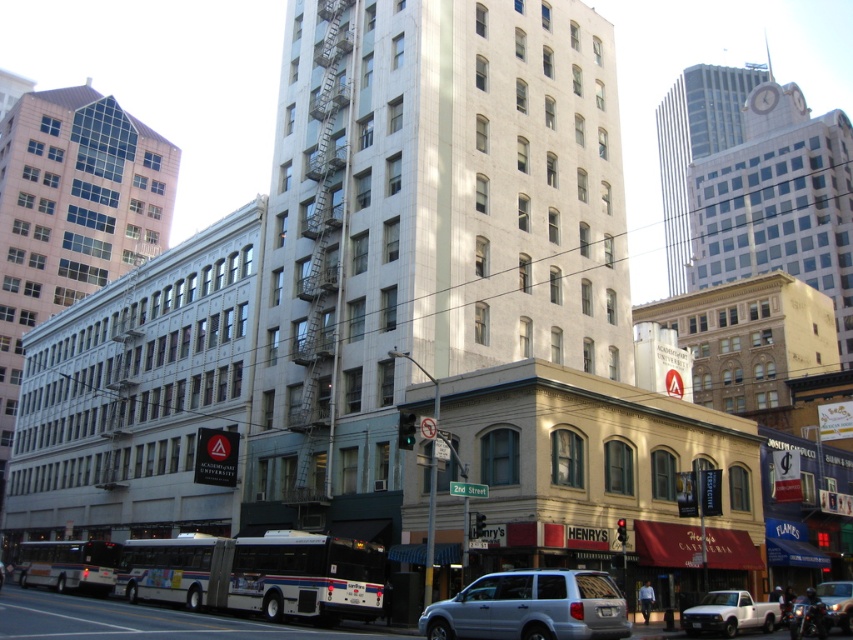
Is white matte truck at lower right to the left of metallic silver car at center from the viewer's perspective?

Correct, you'll find white matte truck at lower right to the left of metallic silver car at center.

Between white matte truck at lower right and metallic silver car at center, which one is positioned higher?

metallic silver car at center

Describe the element at coordinates (729, 612) in the screenshot. I see `white matte truck at lower right` at that location.

Where is `white matte truck at lower right`? white matte truck at lower right is located at coordinates (729, 612).

Between silver metallic suv at lower center and white matte truck at lower right, which one is positioned higher?

silver metallic suv at lower center

Between silver metallic suv at lower center and white matte truck at lower right, which one appears on the left side from the viewer's perspective?

From the viewer's perspective, silver metallic suv at lower center appears more on the left side.

Is point (563, 628) positioned before point (701, 620)?

Yes, it is.

Identify the location of silver metallic suv at lower center. (531, 608).

Can you confirm if silver metallic suv at lower center is thinner than metallic silver car at center?

No, silver metallic suv at lower center is not thinner than metallic silver car at center.

Does silver metallic suv at lower center lie in front of metallic silver car at center?

Yes, silver metallic suv at lower center is in front of metallic silver car at center.

I want to click on silver metallic suv at lower center, so click(531, 608).